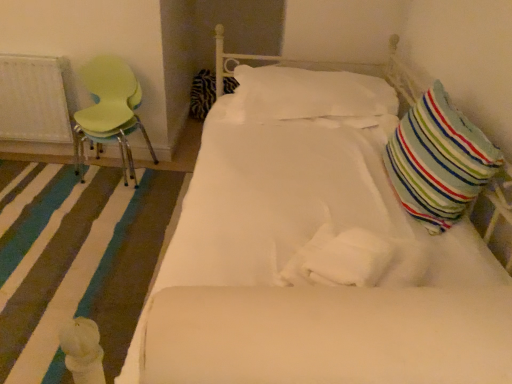
I want to click on vacant space underneath light green plastic chair at left (from a real-world perspective), so click(112, 177).